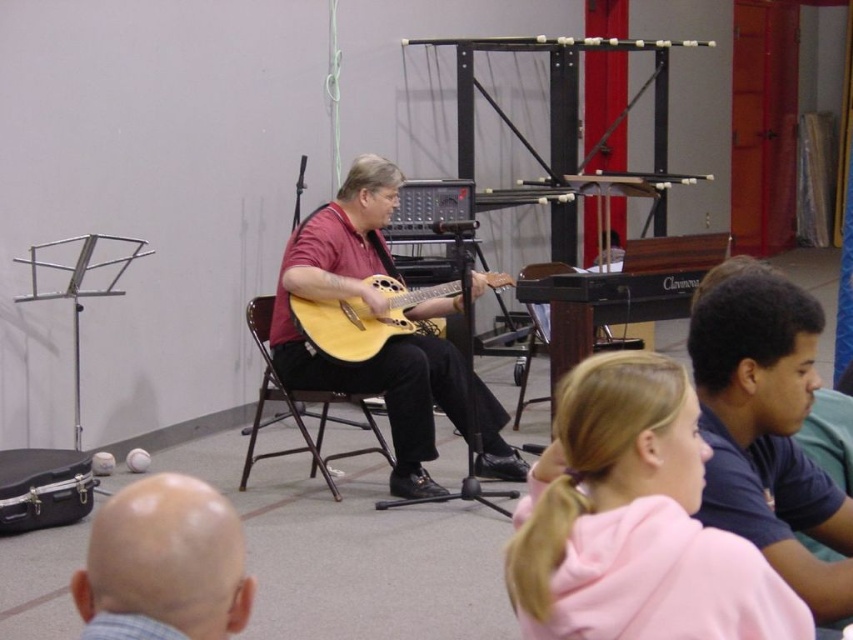
Is point (775, 534) farther from camera compared to point (260, 296)?

No.

Is point (730, 403) in front of point (332, 401)?

That is True.

Does point (721, 493) lie in front of point (312, 392)?

Yes, point (721, 493) is in front of point (312, 392).

The width and height of the screenshot is (853, 640). I want to click on dark blue shirt at lower right, so click(767, 428).

Who is positioned more to the right, dark blue shirt at lower right or bald head at lower left?

Positioned to the right is dark blue shirt at lower right.

Is dark blue shirt at lower right smaller than bald head at lower left?

No, dark blue shirt at lower right is not smaller than bald head at lower left.

Identify the location of dark blue shirt at lower right. This screenshot has width=853, height=640. (767, 428).

Locate an element on the screen. The image size is (853, 640). matte wood guitar at center is located at coordinates (386, 340).

Identify the location of matte wood guitar at center. (386, 340).